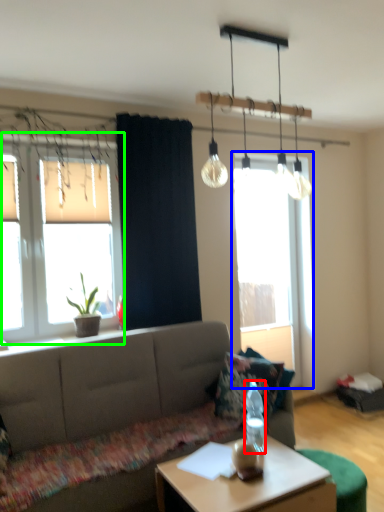
Question: Which object is positioned farthest from bottle (highlighted by a red box)? Select from window (highlighted by a blue box) and window (highlighted by a green box).

Choices:
 (A) window
 (B) window

Answer: (A)